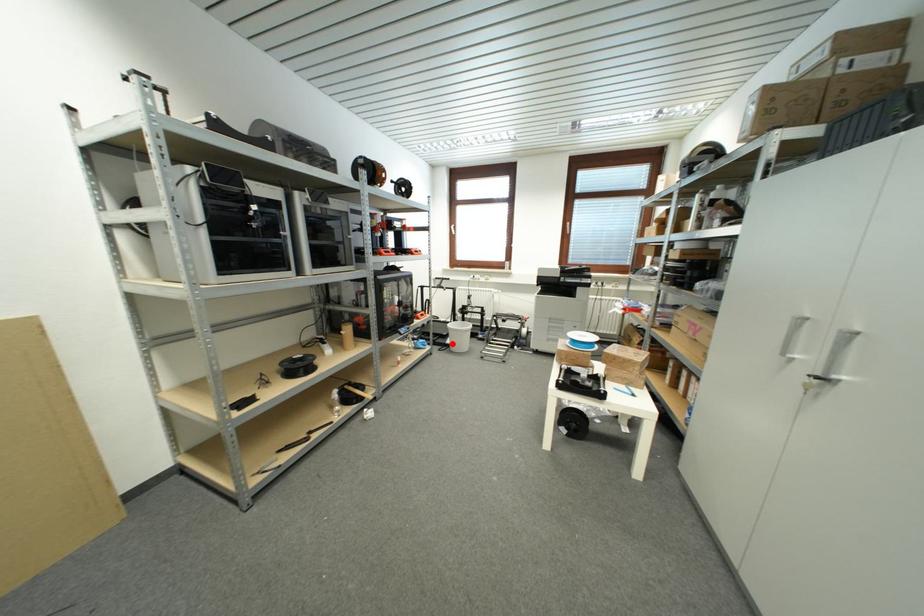
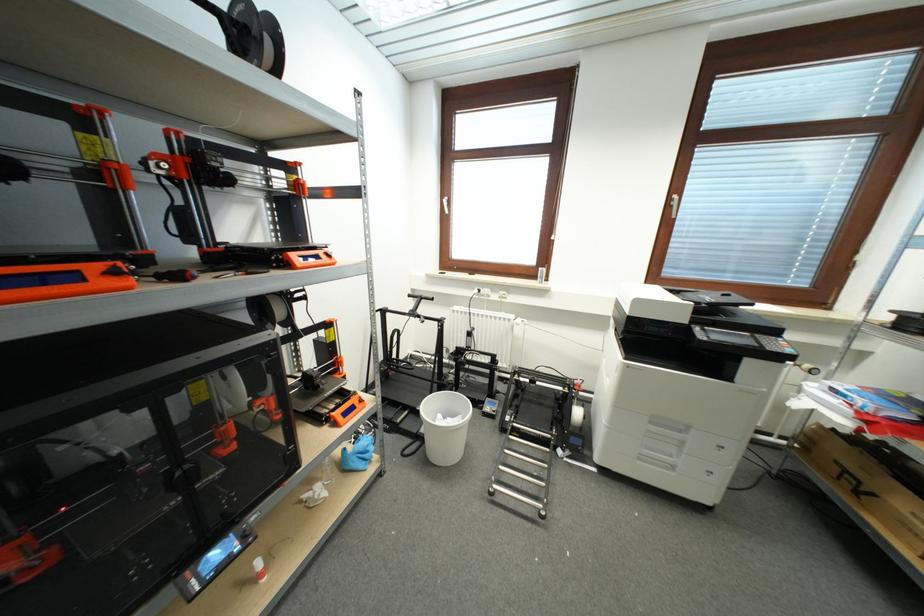
Locate, in the second image, the point that corresponds to the highlighted location in the first image.

(427, 434)